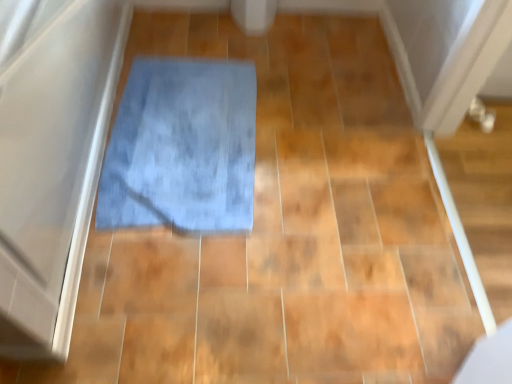
Where is `transparent plastic screen door at left`? This screenshot has width=512, height=384. transparent plastic screen door at left is located at coordinates (51, 159).

Image resolution: width=512 pixels, height=384 pixels. What do you see at coordinates (51, 159) in the screenshot?
I see `transparent plastic screen door at left` at bounding box center [51, 159].

The width and height of the screenshot is (512, 384). What do you see at coordinates (182, 148) in the screenshot?
I see `blue soft bath mat at center` at bounding box center [182, 148].

You are a GUI agent. You are given a task and a screenshot of the screen. Output one action in this format:
    pyautogui.click(x=<x>, y=<y>)
    Task: Click on the blue soft bath mat at center
    This screenshot has width=512, height=384.
    Given the screenshot: What is the action you would take?
    pyautogui.click(x=182, y=148)

Find the location of a particular element. This screenshot has height=384, width=512. transparent plastic screen door at left is located at coordinates (51, 159).

Can you confirm if blue soft bath mat at center is positioned to the right of transparent plastic screen door at left?

Correct, you'll find blue soft bath mat at center to the right of transparent plastic screen door at left.

Which object is further away from the camera taking this photo, blue soft bath mat at center or transparent plastic screen door at left?

blue soft bath mat at center is behind.

Considering the positions of points (251, 150) and (3, 251), is point (251, 150) farther from camera compared to point (3, 251)?

Yes, point (251, 150) is behind point (3, 251).

From the image's perspective, relative to transparent plastic screen door at left, is blue soft bath mat at center above or below?

blue soft bath mat at center is below transparent plastic screen door at left.

From a real-world perspective, which object stands above the other?

transparent plastic screen door at left is physically above.

Which of these two, blue soft bath mat at center or transparent plastic screen door at left, is thinner?

With smaller width is blue soft bath mat at center.

Does blue soft bath mat at center have a greater height compared to transparent plastic screen door at left?

No.

Between blue soft bath mat at center and transparent plastic screen door at left, which one has smaller size?

With smaller size is blue soft bath mat at center.

Is transparent plastic screen door at left located within blue soft bath mat at center?

No.

Is there a large distance between blue soft bath mat at center and transparent plastic screen door at left?

That's not correct — blue soft bath mat at center is a little close to transparent plastic screen door at left.

Is blue soft bath mat at center oriented towards transparent plastic screen door at left?

No, blue soft bath mat at center does not turn towards transparent plastic screen door at left.

How many degrees apart are the facing directions of blue soft bath mat at center and transparent plastic screen door at left?

The facing directions of blue soft bath mat at center and transparent plastic screen door at left are 3.15 degrees apart.

Where is `bath mat below the transparent plastic screen door at left (from the image's perspective)`? The image size is (512, 384). bath mat below the transparent plastic screen door at left (from the image's perspective) is located at coordinates (182, 148).

Considering the relative positions of transparent plastic screen door at left and blue soft bath mat at center in the image provided, is transparent plastic screen door at left to the left or to the right of blue soft bath mat at center?

Clearly, transparent plastic screen door at left is on the left of blue soft bath mat at center in the image.

Is transparent plastic screen door at left closer to the viewer compared to blue soft bath mat at center?

Yes, transparent plastic screen door at left is closer to the viewer.

Consider the image. Which point is more forward, [16,287] or [242,184]?

Point [16,287]

From the image's perspective, is transparent plastic screen door at left located beneath blue soft bath mat at center?

No, from the image's perspective, transparent plastic screen door at left is not below blue soft bath mat at center.

In the scene shown: From a real-world perspective, is transparent plastic screen door at left located higher than blue soft bath mat at center?

Yes, from a real-world perspective, transparent plastic screen door at left is on top of blue soft bath mat at center.

Considering the relative sizes of transparent plastic screen door at left and blue soft bath mat at center in the image provided, is transparent plastic screen door at left wider than blue soft bath mat at center?

Yes, transparent plastic screen door at left is wider than blue soft bath mat at center.

Considering the relative sizes of transparent plastic screen door at left and blue soft bath mat at center in the image provided, is transparent plastic screen door at left taller than blue soft bath mat at center?

Indeed, transparent plastic screen door at left has a greater height compared to blue soft bath mat at center.

Does transparent plastic screen door at left have a smaller size compared to blue soft bath mat at center?

Actually, transparent plastic screen door at left might be larger than blue soft bath mat at center.

Is transparent plastic screen door at left situated inside blue soft bath mat at center or outside?

transparent plastic screen door at left is not inside blue soft bath mat at center, it's outside.

Based on the photo, would you consider transparent plastic screen door at left to be distant from blue soft bath mat at center?

No, transparent plastic screen door at left is not far from blue soft bath mat at center.

Is transparent plastic screen door at left turned away from blue soft bath mat at center?

No, blue soft bath mat at center is not at the back of transparent plastic screen door at left.

How different are the orientations of transparent plastic screen door at left and blue soft bath mat at center in degrees?

transparent plastic screen door at left and blue soft bath mat at center are facing 3.15 degrees away from each other.

The image size is (512, 384). I want to click on screen door in front of the blue soft bath mat at center, so click(x=51, y=159).

You are a GUI agent. You are given a task and a screenshot of the screen. Output one action in this format:
    pyautogui.click(x=<x>, y=<y>)
    Task: Click on the bath mat below the transparent plastic screen door at left (from the image's perspective)
    
    Given the screenshot: What is the action you would take?
    pyautogui.click(x=182, y=148)

Identify the location of screen door in front of the blue soft bath mat at center. (51, 159).